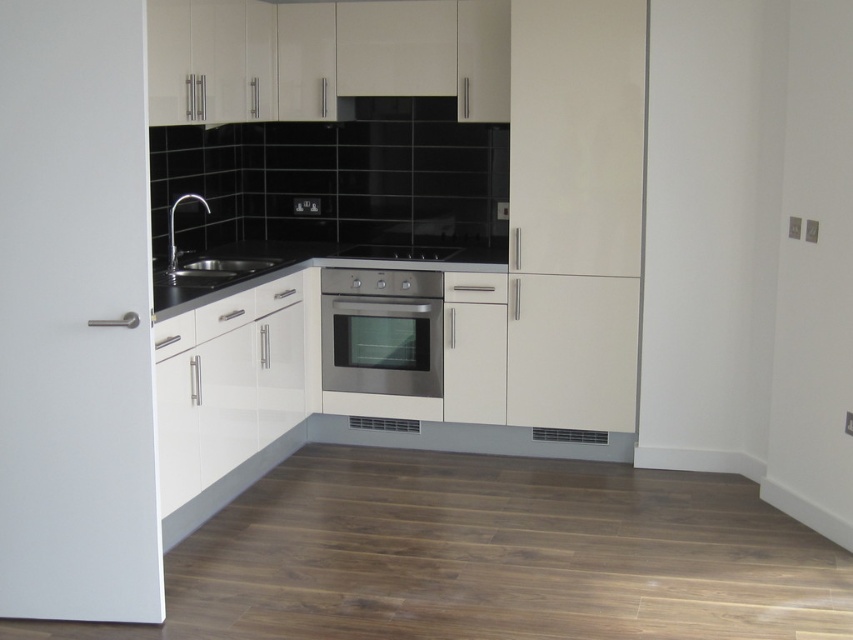
Question: Which object appears farthest from the camera in this image?

Choices:
 (A) satin nickel sink at center
 (B) black glossy countertop at center

Answer: (A)

Question: Can you confirm if stainless steel oven at center is wider than stainless steel stove at center?

Choices:
 (A) yes
 (B) no

Answer: (B)

Question: Which object is closer to the camera taking this photo?

Choices:
 (A) satin nickel sink at center
 (B) stainless steel stove at center
 (C) stainless steel oven at center

Answer: (A)

Question: Where is black glossy countertop at center located in relation to stainless steel stove at center in the image?

Choices:
 (A) below
 (B) above

Answer: (A)

Question: Which object is positioned closest to the stainless steel oven at center?

Choices:
 (A) satin nickel sink at center
 (B) stainless steel stove at center

Answer: (B)

Question: Does stainless steel oven at center have a larger size compared to stainless steel stove at center?

Choices:
 (A) yes
 (B) no

Answer: (A)